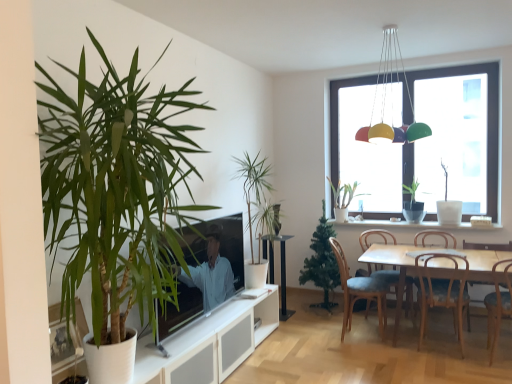
The height and width of the screenshot is (384, 512). Find the location of `vacant area situated below multicolored plastic light fixture at upper center (from a real-world perspective)`. vacant area situated below multicolored plastic light fixture at upper center (from a real-world perspective) is located at coordinates (393, 351).